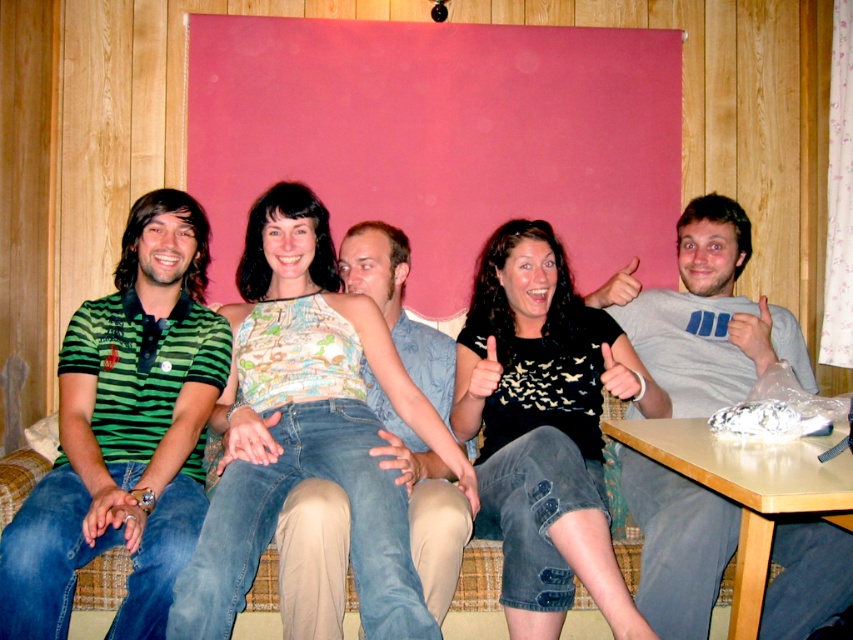
Question: Is patterned fabric top at center smaller than gray cotton shirt at center?

Choices:
 (A) yes
 (B) no

Answer: (A)

Question: Among these points, which one is nearest to the camera?

Choices:
 (A) (213, 492)
 (B) (587, 570)
 (C) (132, 486)
 (D) (775, 557)

Answer: (B)

Question: Is green striped polo shirt at left above gray cotton shirt at center?

Choices:
 (A) no
 (B) yes

Answer: (B)

Question: Which point is closer to the camera taking this photo?

Choices:
 (A) (233, 502)
 (B) (628, 461)

Answer: (A)

Question: Does black matte shirt at center appear on the left side of gray cotton shirt at center?

Choices:
 (A) yes
 (B) no

Answer: (A)

Question: Which point is farther to the camera?

Choices:
 (A) (712, 524)
 (B) (515, 422)

Answer: (B)